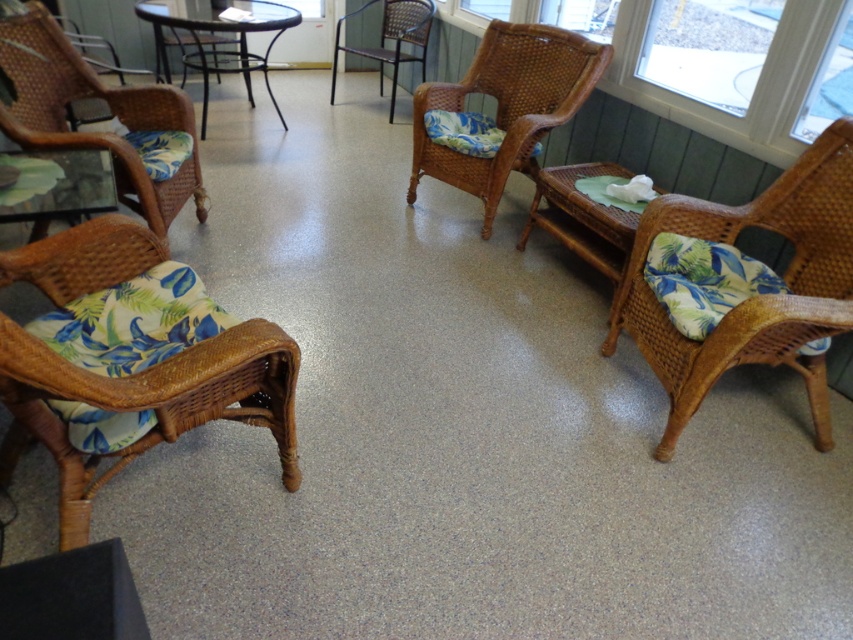
You are planning to place a rectangular coffee table between the woven rattan chair with floral cushion at left and the woven brown armchair at center. The coffee table measures 1.2 meters in width. Can the coffee table fit between them?

The woven rattan chair with floral cushion at left is narrower than the woven brown armchair at center. However, the exact distance between them isn

You are standing in the seating area and want to move closer to the woven rattan rocking chair at lower left. If your maximum comfortable walking distance is 3 feet, can you reach it without straining?

The woven rattan rocking chair at lower left is 3.82 feet from the camera, which exceeds your 3 feet comfortable walking distance, so you would need to strain to reach it.